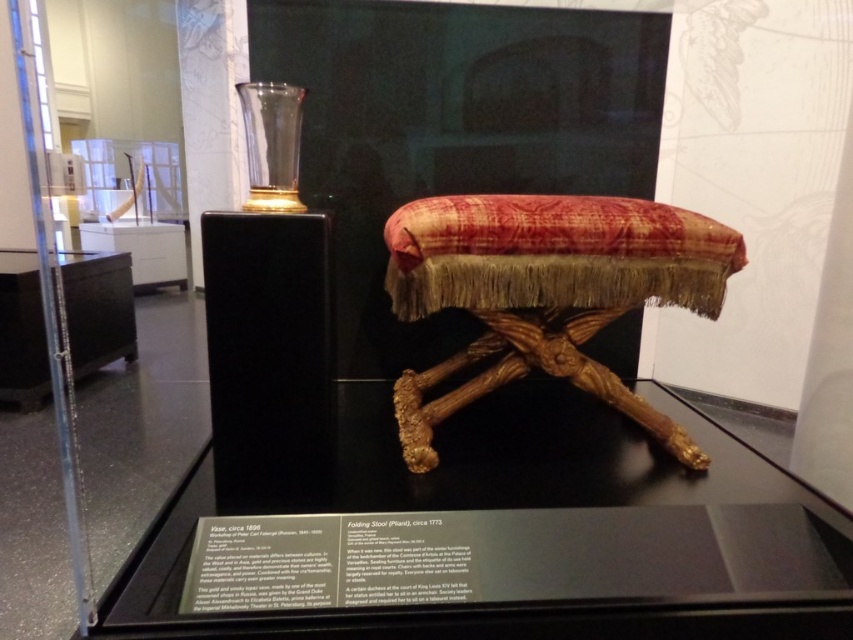
Can you confirm if transparent glass table at center is taller than velvet-textured stool at center?

In fact, transparent glass table at center may be shorter than velvet-textured stool at center.

Which of these two, transparent glass table at center or velvet-textured stool at center, stands shorter?

With less height is transparent glass table at center.

Is point (469, 467) positioned behind point (567, 250)?

Yes, it is behind point (567, 250).

Locate an element on the screen. transparent glass table at center is located at coordinates (540, 531).